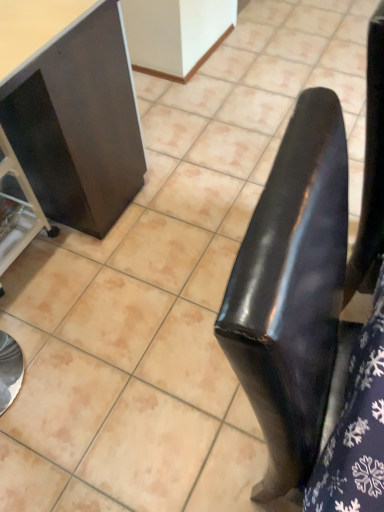
At what (x,y) coordinates should I click in order to perform the action: click on free location in front of metallic silver cart at left, the 2th furniture when ordered from right to left. Please return your answer as a coordinate pair (x, y). This screenshot has height=512, width=384. Looking at the image, I should click on (34, 316).